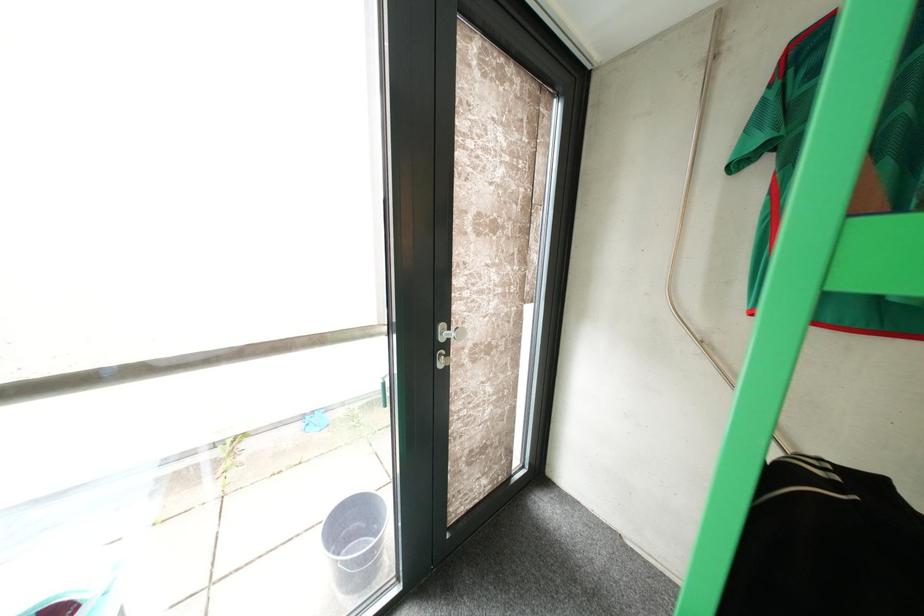
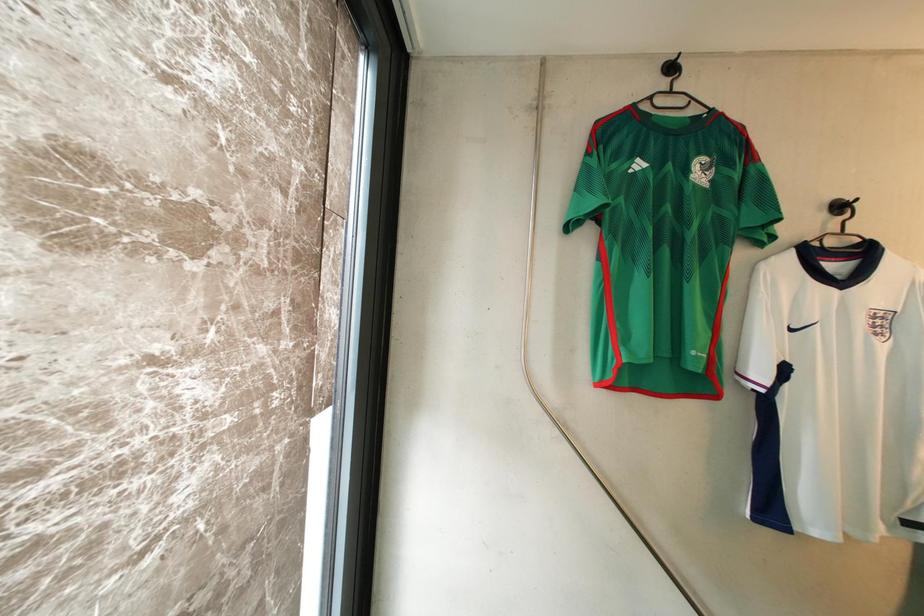
Question: Based on the continuous images, in which direction is the camera rotating? Reply with the corresponding letter.

Choices:
 (A) Left
 (B) Right
 (C) Up
 (D) Down

Answer: (B)